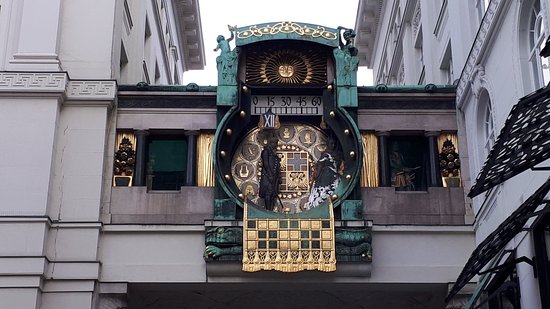
Where is `pillar`? This screenshot has height=309, width=550. pillar is located at coordinates (525, 295).